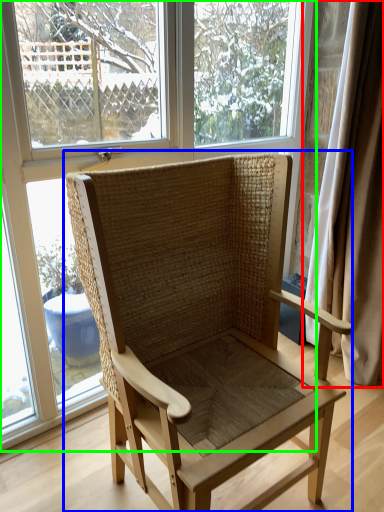
Question: Which object is the closest to the curtain (highlighted by a red box)? Choose among these: chair (highlighted by a blue box) or window (highlighted by a green box).

Choices:
 (A) chair
 (B) window

Answer: (B)